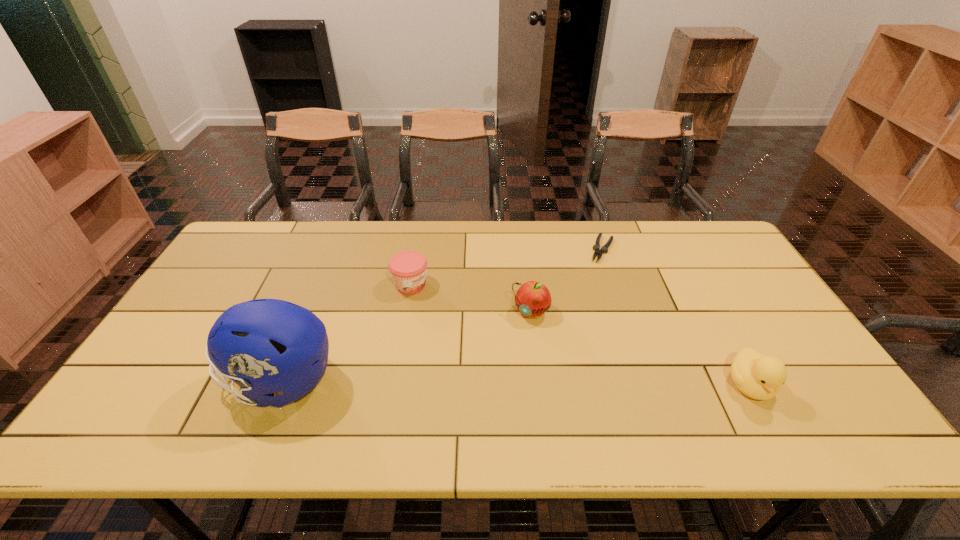
Identify the location of free spot located on the front label of the fourth nearest object. (501, 341).

Identify the location of object present at the far edge. (604, 249).

Locate an element on the screen. Image resolution: width=960 pixels, height=540 pixels. football helmet located at the near edge is located at coordinates (265, 346).

At what (x,y) coordinates should I click in order to perform the action: click on duck that is at the near edge. Please return your answer as a coordinate pair (x, y). Looking at the image, I should click on (760, 377).

Find the location of a particular element. The height and width of the screenshot is (540, 960). object that is at the right edge is located at coordinates (760, 377).

Locate an element on the screen. Image resolution: width=960 pixels, height=540 pixels. object present at the near right corner is located at coordinates (760, 377).

Find the location of a particular element. vacant position at the far edge of the desktop is located at coordinates click(x=294, y=222).

The image size is (960, 540). Identify the location of vacant space at the near edge of the desktop. (577, 381).

Locate an element on the screen. Image resolution: width=960 pixels, height=540 pixels. vacant area at the left edge is located at coordinates (198, 332).

The width and height of the screenshot is (960, 540). I want to click on vacant area at the right edge of the desktop, so click(780, 338).